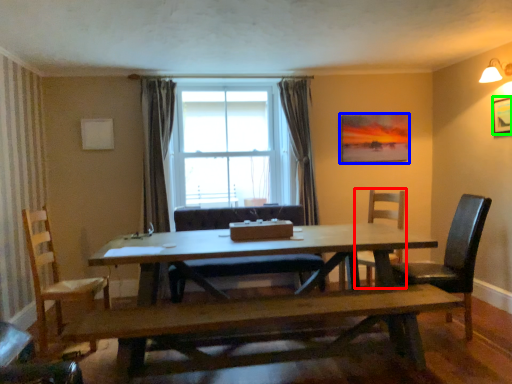
Question: Which object is positioned farthest from chair (highlighted by a red box)? Select from picture frame (highlighted by a blue box) and picture frame (highlighted by a green box).

Choices:
 (A) picture frame
 (B) picture frame

Answer: (B)